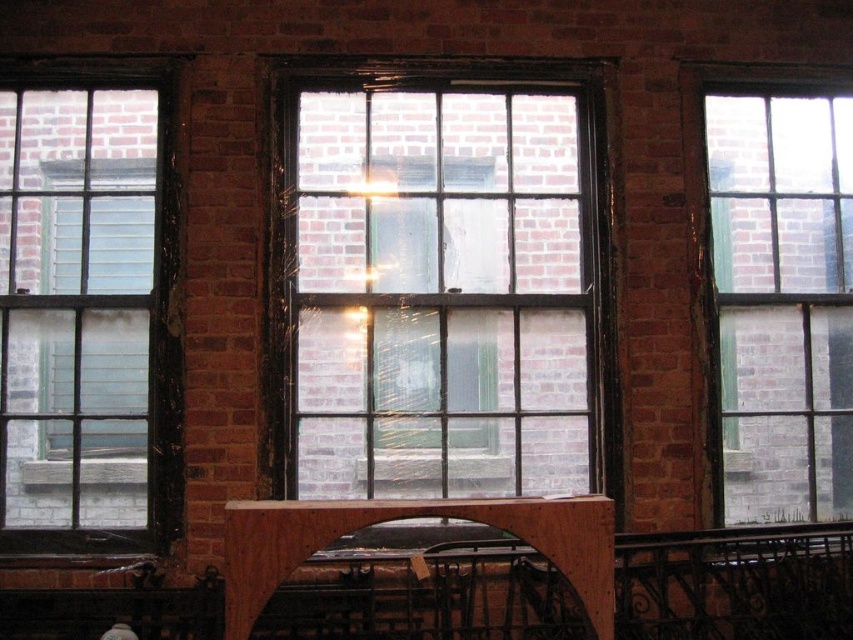
You are standing in front of a brick wall with windows. You need to locate the clear glass window at center. What are its coordinates?

The clear glass window at center is located at coordinates point (440, 285).

You are an architect assessing the building facade. You need to install a new security film on both the clear glass window at left and the clear glass window at upper right. Given that the film rolls are sold by width, which window requires a wider film roll?

The clear glass window at left requires a wider film roll because its width is larger than the clear glass window at upper right.

You are standing in front of a brick wall with two windows. You notice a clear glass window at center and a wooden at center. Which object is positioned higher on the wall?

The clear glass window at center is above the wooden at center, so it is positioned higher on the wall.